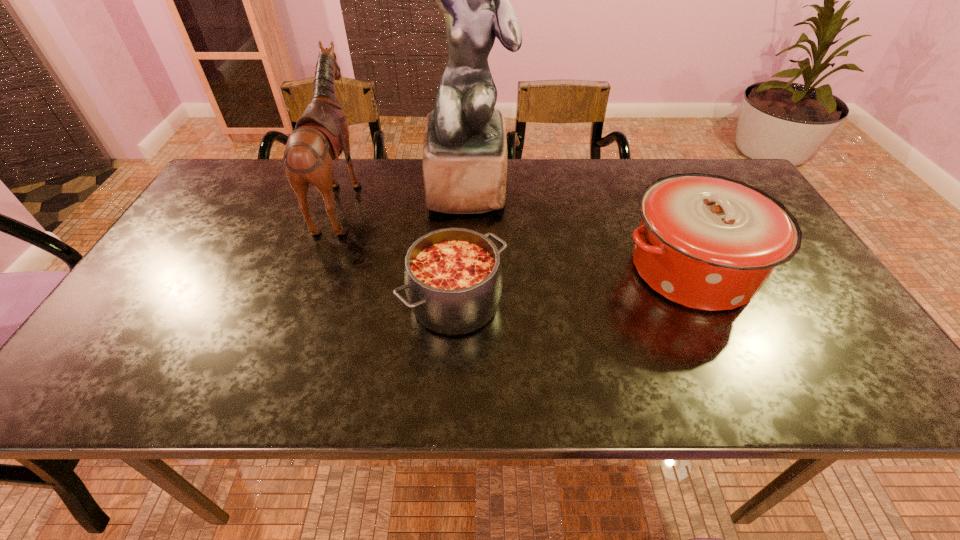
Identify the location of vacant area situated 0.060m on the front of the shortest object. (452, 368).

Locate an element on the screen. sculpture that is at the far edge is located at coordinates (464, 162).

Where is `saddle located at the far edge`? saddle located at the far edge is located at coordinates (321, 134).

You are a GUI agent. You are given a task and a screenshot of the screen. Output one action in this format:
    pyautogui.click(x=<x>, y=<y>)
    Task: Click on the object that is at the right edge
    
    Given the screenshot: What is the action you would take?
    pyautogui.click(x=707, y=242)

The height and width of the screenshot is (540, 960). In the image, there is a desktop. Identify the location of vacant space at the far edge. (396, 168).

At what (x,y) coordinates should I click in order to perform the action: click on free region at the near edge. Please return your answer as a coordinate pair (x, y). The width and height of the screenshot is (960, 540). Looking at the image, I should click on (427, 383).

Identify the location of free space at the left edge. The height and width of the screenshot is (540, 960). (224, 218).

The width and height of the screenshot is (960, 540). In order to click on vacant space at the near left corner of the desktop in this screenshot , I will do `click(77, 395)`.

In the image, there is a desktop. Where is `vacant space at the far right corner`? The image size is (960, 540). vacant space at the far right corner is located at coordinates (698, 160).

Where is `vacant space in between the tallest object and the third tallest object`? vacant space in between the tallest object and the third tallest object is located at coordinates (581, 228).